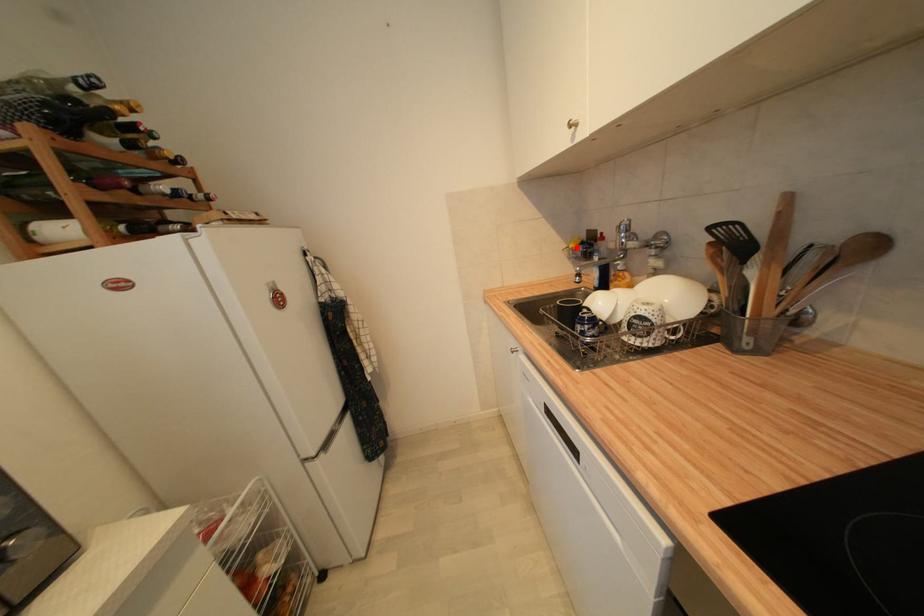
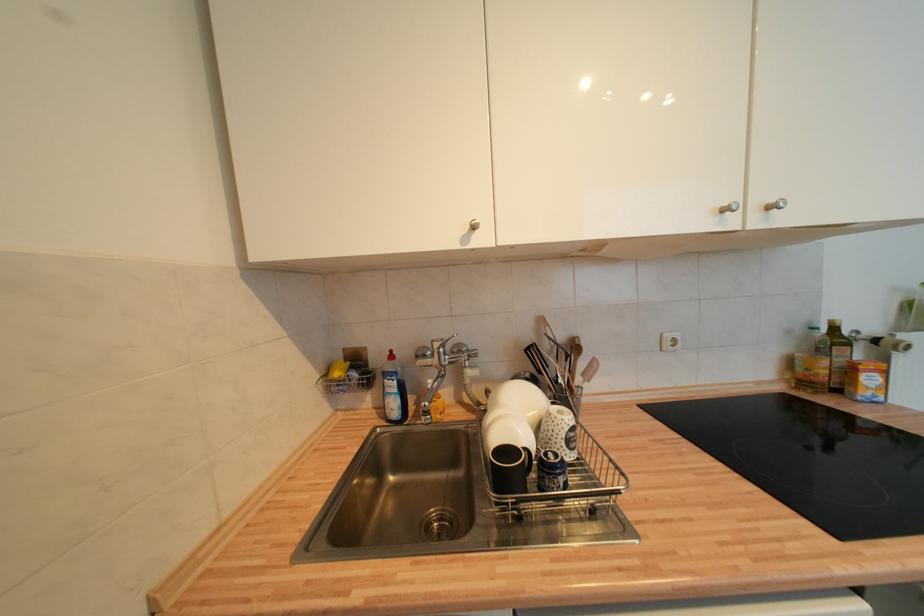
Find the pixel in the second image that matches the highlighted location in the first image.

(343, 376)